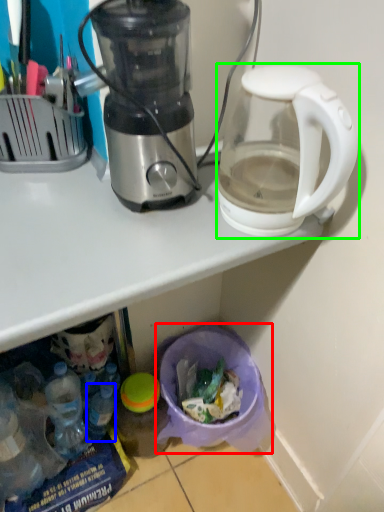
Question: Which object is the closest to the garbage (highlighted by a red box)? Choose among these: bottle (highlighted by a blue box) or coffee maker (highlighted by a green box).

Choices:
 (A) bottle
 (B) coffee maker

Answer: (A)